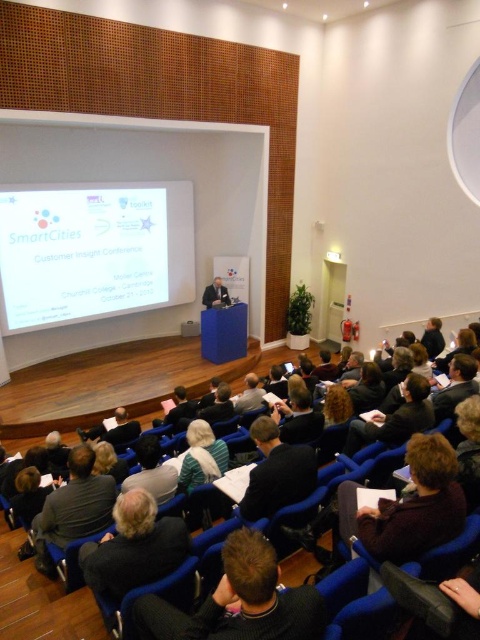
Question: Which object is farther from the camera taking this photo?

Choices:
 (A) dark brown leather jacket at lower center
 (B) white glossy projector screen at center
 (C) dark gray sweater at lower center

Answer: (B)

Question: Is white glossy projector screen at center below green striped sweater at center?

Choices:
 (A) no
 (B) yes

Answer: (A)

Question: Which of the following is the closest to the observer?

Choices:
 (A) (259, 476)
 (B) (205, 298)
 (C) (201, 448)
 (D) (137, 506)

Answer: (D)

Question: Is white glossy projector screen at center bigger than dark gray sweater at lower center?

Choices:
 (A) no
 (B) yes

Answer: (B)

Question: Among these points, which one is farthest from the camera?

Choices:
 (A) (274, 488)
 (B) (226, 289)
 (C) (412, 433)

Answer: (B)

Question: Is dark brown sweater at lower center wider than dark gray sweater at lower left?

Choices:
 (A) yes
 (B) no

Answer: (B)